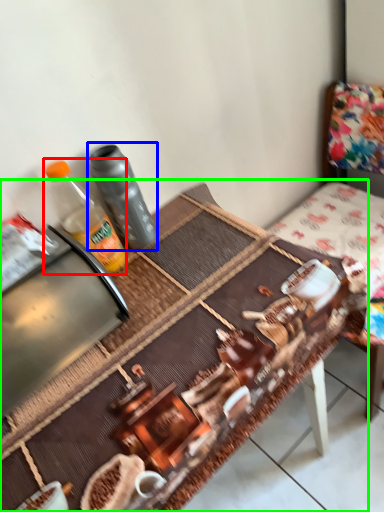
Question: Which is nearer to the bottle (highlighted by a red box)? bottle (highlighted by a blue box) or table (highlighted by a green box).

Choices:
 (A) bottle
 (B) table

Answer: (A)